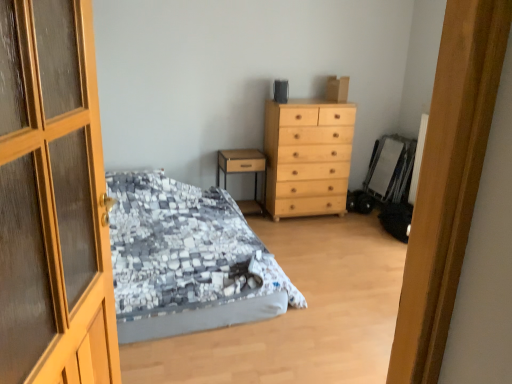
Question: From the image's perspective, is wooden door at left above textured gray bed at center?

Choices:
 (A) no
 (B) yes

Answer: (B)

Question: Does wooden door at left appear on the left side of textured gray bed at center?

Choices:
 (A) no
 (B) yes

Answer: (B)

Question: Is wooden door at left closer to the viewer compared to textured gray bed at center?

Choices:
 (A) yes
 (B) no

Answer: (A)

Question: Can you confirm if wooden door at left is smaller than textured gray bed at center?

Choices:
 (A) yes
 (B) no

Answer: (A)

Question: Is wooden door at left positioned behind textured gray bed at center?

Choices:
 (A) no
 (B) yes

Answer: (A)

Question: Is light wood/texture chest of drawers at center in front of or behind textured gray bed at center in the image?

Choices:
 (A) front
 (B) behind

Answer: (B)

Question: Is light wood/texture chest of drawers at center inside the boundaries of textured gray bed at center, or outside?

Choices:
 (A) outside
 (B) inside

Answer: (A)

Question: From a real-world perspective, is light wood/texture chest of drawers at center positioned above or below textured gray bed at center?

Choices:
 (A) below
 (B) above

Answer: (B)

Question: Is light wood/texture chest of drawers at center wider or thinner than textured gray bed at center?

Choices:
 (A) wide
 (B) thin

Answer: (B)

Question: From a real-world perspective, is wooden door at left physically located above or below light wood/texture chest of drawers at center?

Choices:
 (A) below
 (B) above

Answer: (B)

Question: Relative to light wood/texture chest of drawers at center, is wooden door at left in front or behind?

Choices:
 (A) front
 (B) behind

Answer: (A)

Question: Does point (56, 332) appear closer or farther from the camera than point (279, 208)?

Choices:
 (A) closer
 (B) farther

Answer: (A)

Question: From the image's perspective, relative to light wood/texture chest of drawers at center, is wooden door at left above or below?

Choices:
 (A) below
 (B) above

Answer: (A)

Question: Do you think light wood/texture chest of drawers at center is within wooden nightstand at center, or outside of it?

Choices:
 (A) inside
 (B) outside

Answer: (B)

Question: In terms of width, does light wood/texture chest of drawers at center look wider or thinner when compared to wooden nightstand at center?

Choices:
 (A) thin
 (B) wide

Answer: (B)